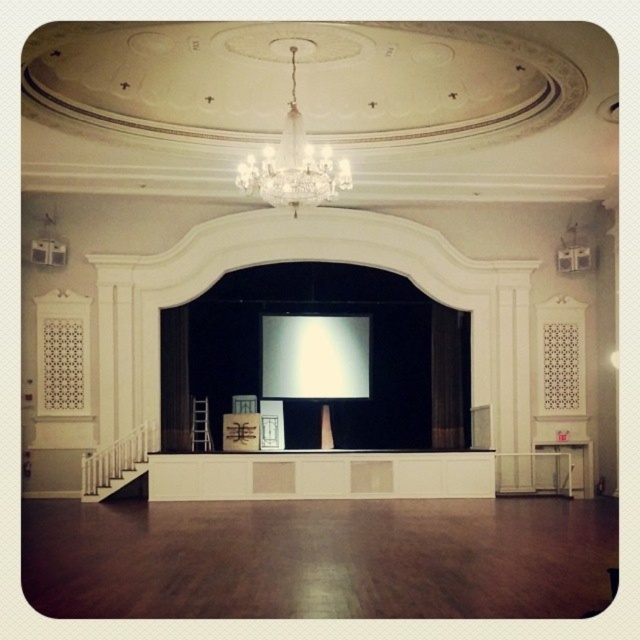
You are an event planner setting up for a presentation. You need to ensure that the crystal glass chandelier at upper center does not cast shadows on the white glossy projection screen at center. Based on their positions, is this possible?

The crystal glass chandelier at upper center is behind the white glossy projection screen at center, so it will not cast a shadow on the screen since it is positioned behind it.

You are an event planner setting up a new projector. The projector needs to be placed at the point with coordinates [314,356]. What object is located at this coordinate?

The point at coordinates [314,356] indicates the white glossy projection screen at center.